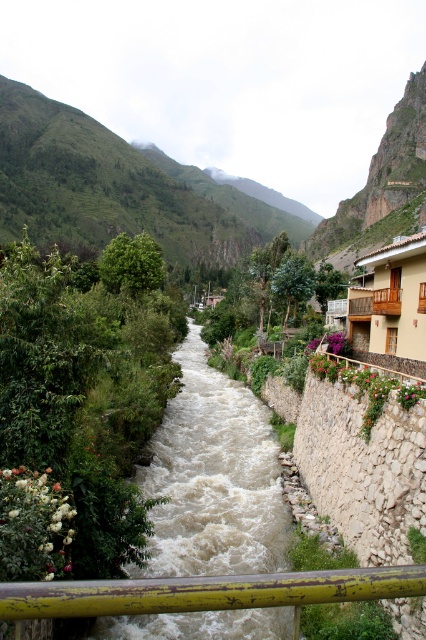
Question: Which point is closer to the camera?

Choices:
 (A) yellow weathered rail at center
 (B) green grassy mountain at upper left
 (C) white frothy water at center

Answer: (A)

Question: Considering the relative positions of white frothy water at center and green grassy mountain at upper left in the image provided, where is white frothy water at center located with respect to green grassy mountain at upper left?

Choices:
 (A) left
 (B) right

Answer: (B)

Question: Can you confirm if green grassy mountain at upper left is thinner than yellow weathered rail at center?

Choices:
 (A) yes
 (B) no

Answer: (B)

Question: Which point appears closest to the camera in this image?

Choices:
 (A) pos(5,90)
 (B) pos(284,582)

Answer: (B)

Question: Is white frothy water at center smaller than yellow weathered rail at center?

Choices:
 (A) yes
 (B) no

Answer: (B)

Question: Which point is farther from the camera taking this photo?

Choices:
 (A) (13, 586)
 (B) (69, 116)

Answer: (B)